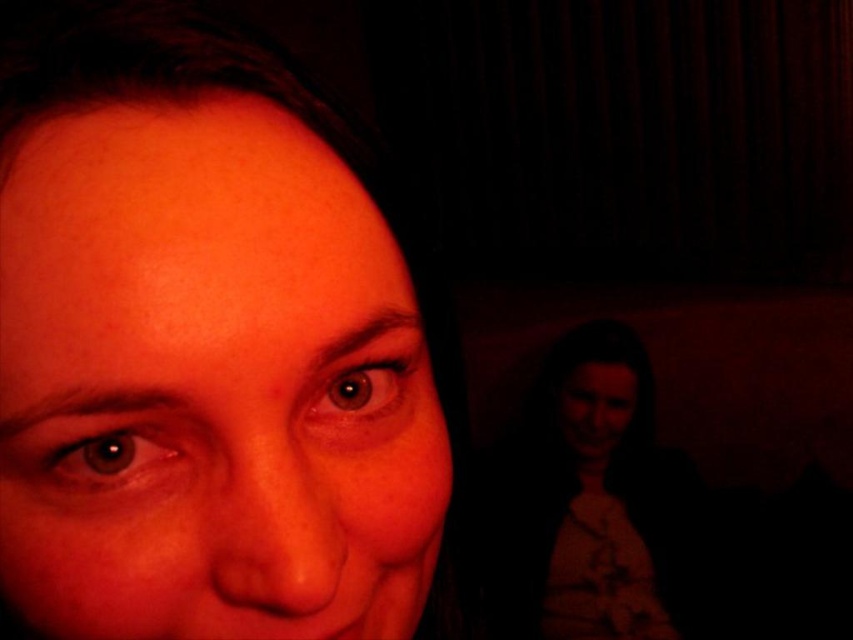
Question: Is matte skin at center below matte white blouse at lower right?

Choices:
 (A) no
 (B) yes

Answer: (A)

Question: Is matte skin at center to the left of matte white blouse at lower right from the viewer's perspective?

Choices:
 (A) no
 (B) yes

Answer: (B)

Question: Does matte skin at center lie in front of matte white blouse at lower right?

Choices:
 (A) no
 (B) yes

Answer: (B)